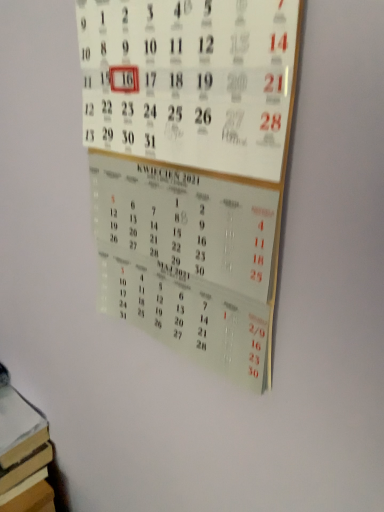
Question: From the image's perspective, is brown cardboard book at lower left beneath white paper calendar at center?

Choices:
 (A) yes
 (B) no

Answer: (A)

Question: Is brown cardboard book at lower left touching white paper calendar at center?

Choices:
 (A) no
 (B) yes

Answer: (A)

Question: Is brown cardboard book at lower left at the left side of white paper calendar at center?

Choices:
 (A) no
 (B) yes

Answer: (B)

Question: Is brown cardboard book at lower left further to camera compared to white paper calendar at center?

Choices:
 (A) no
 (B) yes

Answer: (B)

Question: Is the depth of brown cardboard book at lower left less than that of white paper calendar at center?

Choices:
 (A) yes
 (B) no

Answer: (B)

Question: From a real-world perspective, is brown cardboard book at lower left physically above white paper calendar at center?

Choices:
 (A) no
 (B) yes

Answer: (A)

Question: Does white paper calendar at center come in front of brown cardboard book at lower left?

Choices:
 (A) no
 (B) yes

Answer: (B)

Question: Does white paper calendar at center have a larger size compared to brown cardboard book at lower left?

Choices:
 (A) yes
 (B) no

Answer: (A)

Question: From a real-world perspective, is white paper calendar at center physically below brown cardboard book at lower left?

Choices:
 (A) no
 (B) yes

Answer: (A)

Question: From the image's perspective, is white paper calendar at center over brown cardboard book at lower left?

Choices:
 (A) no
 (B) yes

Answer: (B)

Question: Is brown cardboard book at lower left a part of white paper calendar at center?

Choices:
 (A) no
 (B) yes

Answer: (A)

Question: Is white paper calendar at center at the right side of brown cardboard book at lower left?

Choices:
 (A) yes
 (B) no

Answer: (A)

Question: Is point [4, 397] positioned closer to the camera than point [288, 74]?

Choices:
 (A) closer
 (B) farther

Answer: (B)